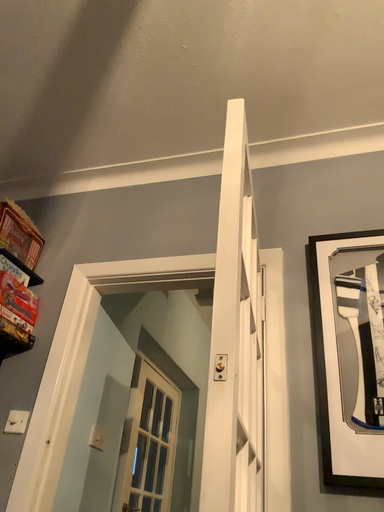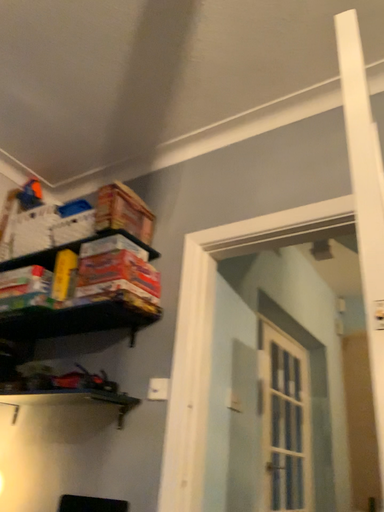
Question: How did the camera likely rotate when shooting the video?

Choices:
 (A) rotated right
 (B) rotated left

Answer: (B)